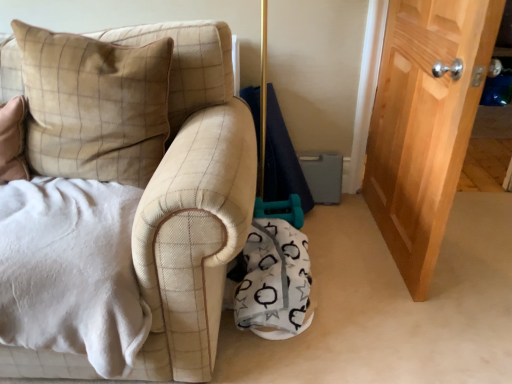
Locate an element on the screen. vacant area in front of white fabric blanket at lower center is located at coordinates (306, 355).